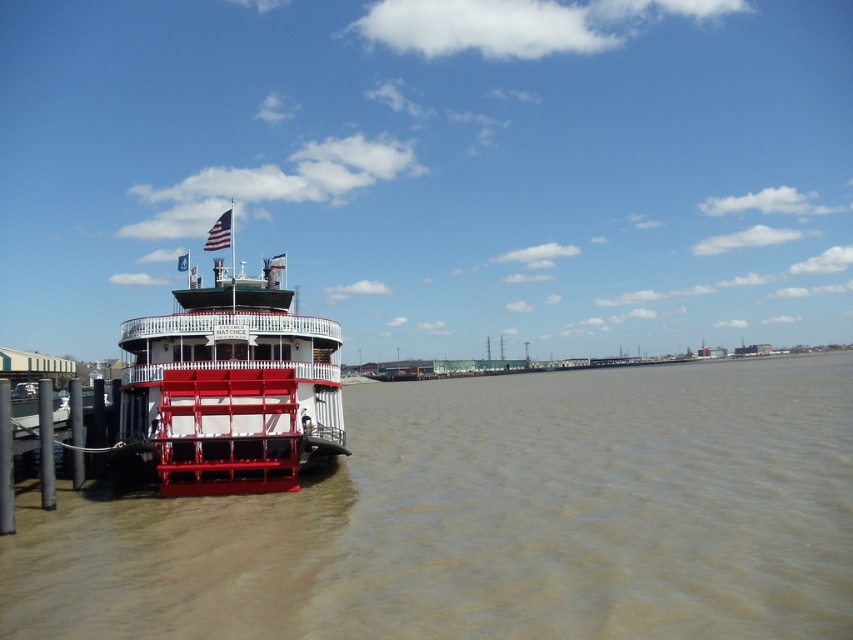
Is brown matte water at lower left thinner than american flag at upper left?

Yes, brown matte water at lower left is thinner than american flag at upper left.

Is brown matte water at lower left bigger than american flag at upper left?

Incorrect, brown matte water at lower left is not larger than american flag at upper left.

Is point (550, 516) positioned before point (219, 248)?

That is True.

Find the location of a particular element. brown matte water at lower left is located at coordinates (491, 518).

Is white matte paddlewheel boat at left thinner than american flag at upper left?

Yes, white matte paddlewheel boat at left is thinner than american flag at upper left.

Can you confirm if white matte paddlewheel boat at left is positioned above american flag at upper left?

No, white matte paddlewheel boat at left is not above american flag at upper left.

This screenshot has height=640, width=853. In order to click on white matte paddlewheel boat at left in this screenshot , I will do `click(230, 388)`.

Where is `white matte paddlewheel boat at left`? white matte paddlewheel boat at left is located at coordinates (230, 388).

Which is above, brown matte water at lower left or white matte paddlewheel boat at left?

white matte paddlewheel boat at left is higher up.

I want to click on brown matte water at lower left, so click(491, 518).

The image size is (853, 640). What are the coordinates of `brown matte water at lower left` in the screenshot? It's located at (491, 518).

The width and height of the screenshot is (853, 640). Identify the location of brown matte water at lower left. (491, 518).